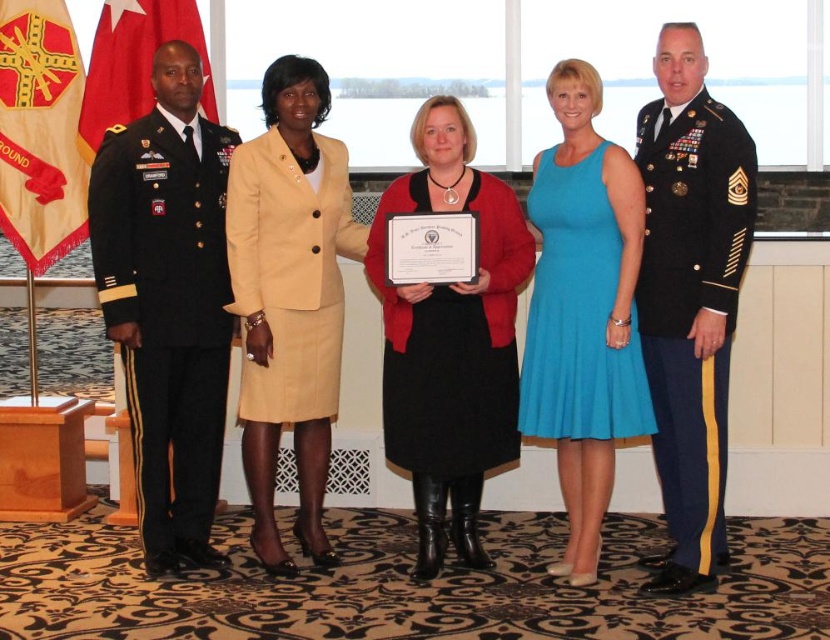
Is turquoise fabric dress at center closer to the viewer compared to red flag at left?

Yes, turquoise fabric dress at center is closer to the viewer.

Is turquoise fabric dress at center to the right of red flag at left from the viewer's perspective?

Indeed, turquoise fabric dress at center is positioned on the right side of red flag at left.

Is point (609, 196) more distant than point (144, 19)?

No, (609, 196) is closer to viewer.

Locate an element on the screen. This screenshot has width=830, height=640. turquoise fabric dress at center is located at coordinates (583, 310).

Can you confirm if turquoise fabric dress at center is positioned below gold/yellow fabric flag at left?

Correct, turquoise fabric dress at center is located below gold/yellow fabric flag at left.

Locate an element on the screen. turquoise fabric dress at center is located at coordinates (583, 310).

Image resolution: width=830 pixels, height=640 pixels. I want to click on turquoise fabric dress at center, so click(583, 310).

Can you confirm if dark green military uniform at right is shorter than gold/yellow fabric flag at left?

No.

Describe the element at coordinates (692, 305) in the screenshot. This screenshot has width=830, height=640. I see `dark green military uniform at right` at that location.

This screenshot has width=830, height=640. Find the location of `dark green military uniform at right`. dark green military uniform at right is located at coordinates (692, 305).